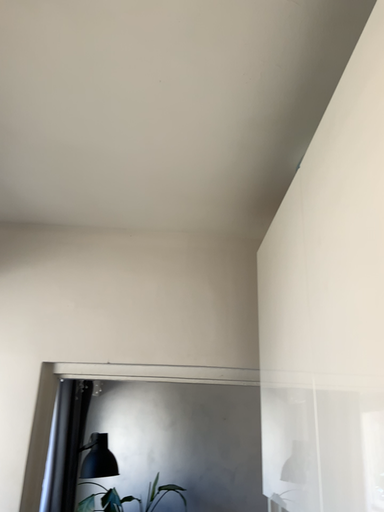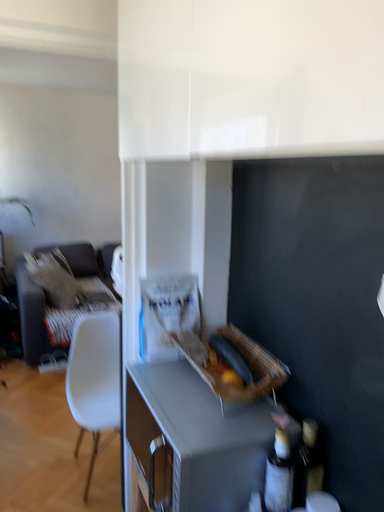
Question: Which way did the camera rotate in the video?

Choices:
 (A) rotated left
 (B) rotated right

Answer: (B)